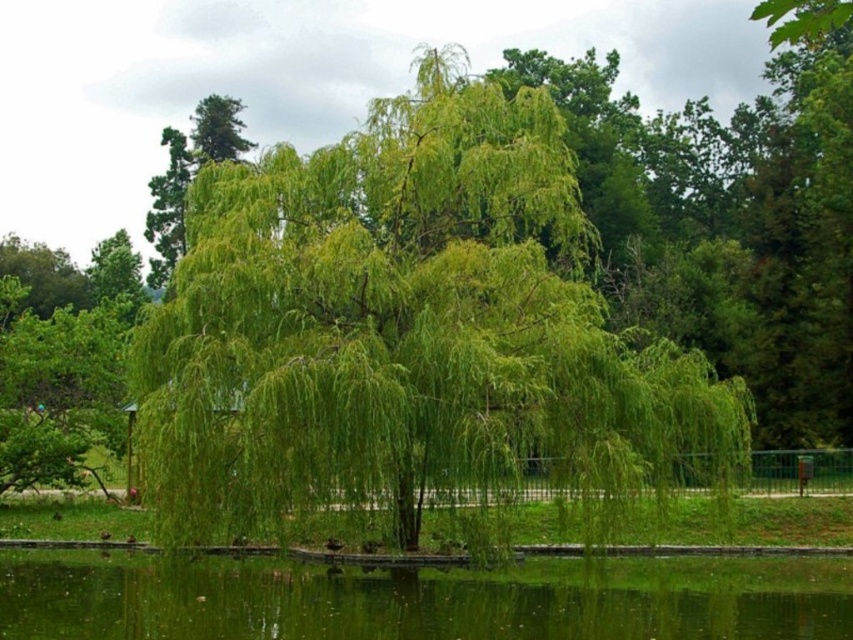
Looking at this image, is green leafy willow at center smaller than green liquid water at lower center?

No.

Is point (505, 429) positioned before point (827, 563)?

Yes, it is.

Find the location of a particular element. The image size is (853, 640). green leafy willow at center is located at coordinates (402, 333).